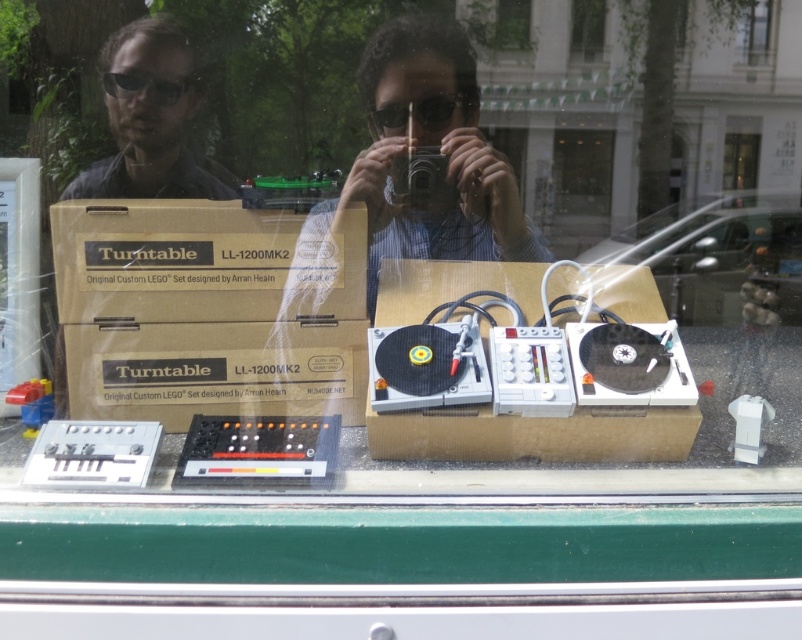
You are a customer in a store looking at the display window. You see the brown cardboard at center and the black plastic goggles at center. Which object is taller?

The brown cardboard at center is taller than the black plastic goggles at center.

In the scene shown: You are a customer looking at the display window and want to touch the black plastic goggles at upper left and the transparent glass window at upper center. Which object should you reach for first if you want to start with the one closer to your left side?

The black plastic goggles at upper left is to the left of transparent glass window at upper center, so you should reach for the black plastic goggles at upper left first since it is closer to your left side.

Looking at this image, you are a customer in a store looking at the display window. You see the brown cardboard at center and the black plastic goggles at center. Which object is wider?

The brown cardboard at center is wider than the black plastic goggles at center.